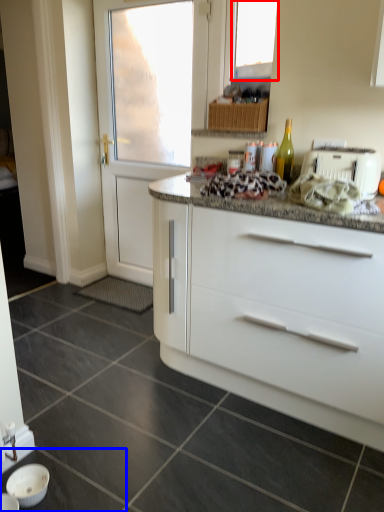
Question: Which object appears closest to the camera in this image, window (highlighted by a red box) or tile (highlighted by a blue box)?

Choices:
 (A) window
 (B) tile

Answer: (B)